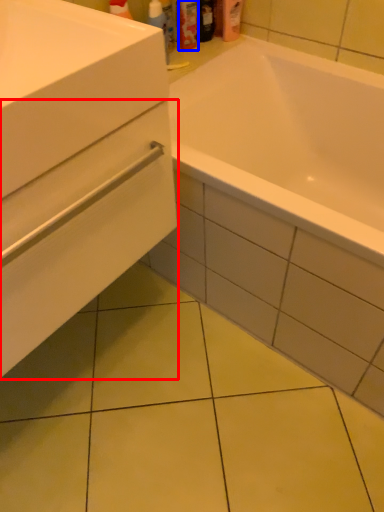
Question: Which of the following is the farthest to the observer, drawer (highlighted by a red box) or toiletry (highlighted by a blue box)?

Choices:
 (A) drawer
 (B) toiletry

Answer: (B)